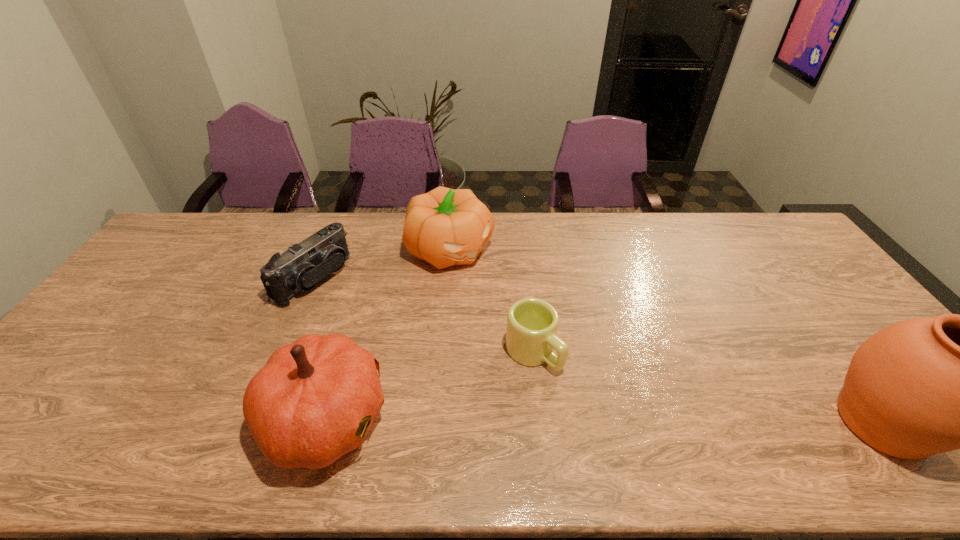
Locate an element on the screen. The image size is (960, 540). blank space located on the carved face of the third tallest object is located at coordinates (519, 304).

Locate an element on the screen. The height and width of the screenshot is (540, 960). vacant region located 0.130m on the carved face of the third tallest object is located at coordinates (506, 293).

The image size is (960, 540). What are the coordinates of `vacant space located on the front-facing side of the camcorder` in the screenshot? It's located at (364, 314).

The height and width of the screenshot is (540, 960). Identify the location of free location located on the front-facing side of the camcorder. (427, 353).

At what (x,y) coordinates should I click in order to perform the action: click on vacant space located on the front-facing side of the camcorder. Please return your answer as a coordinate pair (x, y). Image resolution: width=960 pixels, height=540 pixels. Looking at the image, I should click on (372, 319).

What are the coordinates of `pumpkin situated at the far edge` in the screenshot? It's located at (445, 227).

What are the coordinates of `camcorder present at the far edge` in the screenshot? It's located at (300, 268).

Find the location of a particular element. object present at the near edge is located at coordinates (311, 403).

Identify the location of free space at the far edge of the desktop. This screenshot has height=540, width=960. (635, 252).

Locate an element on the screen. The image size is (960, 540). free region at the near edge is located at coordinates (555, 406).